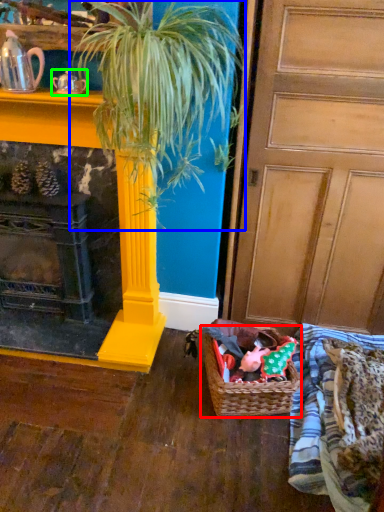
Question: Considering the real-world distances, which object is closest to basket (highlighted by a red box)? houseplant (highlighted by a blue box) or tea pot (highlighted by a green box).

Choices:
 (A) houseplant
 (B) tea pot

Answer: (A)